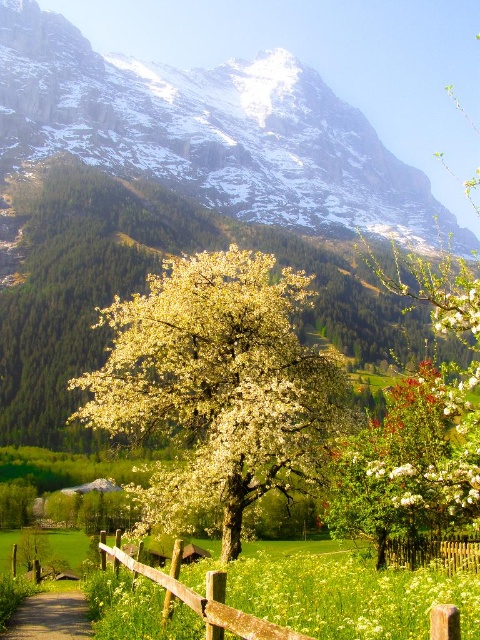
Question: Which is farther from the brown wooden fence at lower right?

Choices:
 (A) white textured tree at center
 (B) white blossoming tree at center
 (C) brown wooden fence at lower center

Answer: (A)

Question: Which point is closer to the camera taking this photo?

Choices:
 (A) (204, 272)
 (B) (135, 637)
 (C) (420, 536)
 (D) (28, 618)

Answer: (B)

Question: Is white textured tree at center positioned in front of white blossoming tree at center?

Choices:
 (A) yes
 (B) no

Answer: (B)

Question: Can you confirm if white blossoming tree at center is positioned above brown wooden fence at lower center?

Choices:
 (A) no
 (B) yes

Answer: (B)

Question: Which point appears farthest from the camera in this image?

Choices:
 (A) (62, 602)
 (B) (429, 556)

Answer: (B)

Question: Does white blossoming tree at center appear under brown wooden fence at lower right?

Choices:
 (A) yes
 (B) no

Answer: (B)